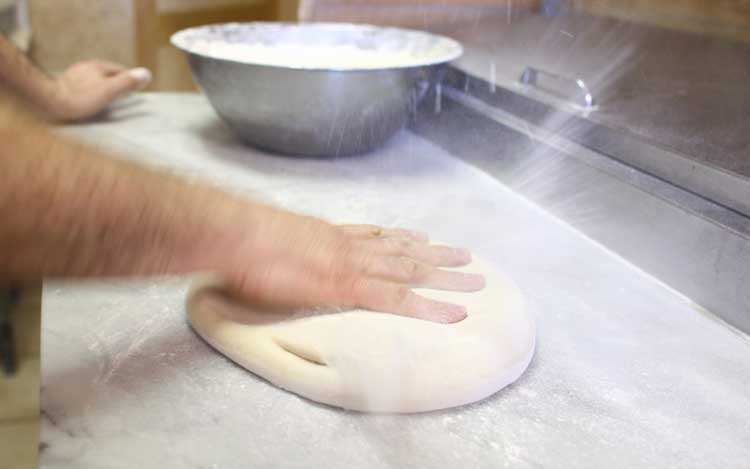
The image size is (750, 469). I want to click on floor, so click(x=22, y=433).